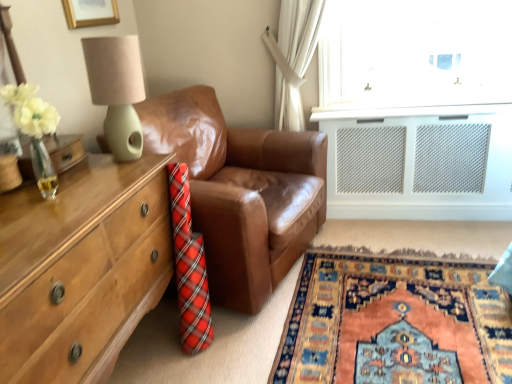
Where is `vacant space in front of matte green lamp at upper left`? Image resolution: width=512 pixels, height=384 pixels. vacant space in front of matte green lamp at upper left is located at coordinates (108, 178).